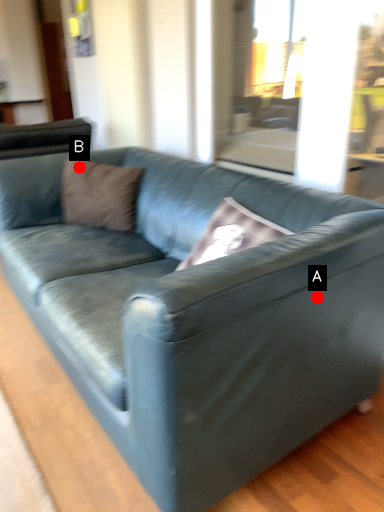
Question: Two points are circled on the image, labeled by A and B beside each circle. Which point is closer to the camera taking this photo?

Choices:
 (A) A is closer
 (B) B is closer

Answer: (A)